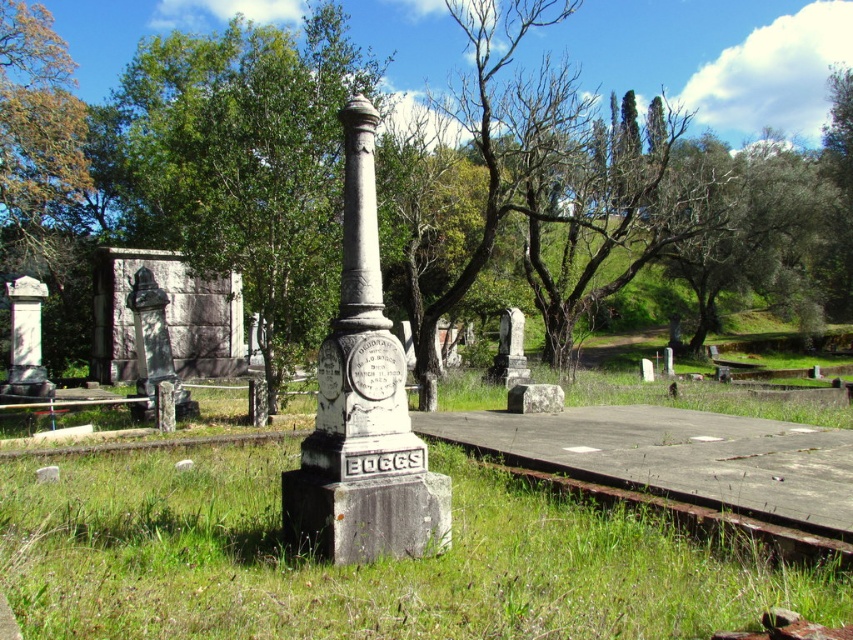
In the scene shown: You are standing at the entrance of the cemetery and want to find the green leafy tree at center. According to the coordinates provided, where should you look relative to your current position?

The green leafy tree at center is located at coordinates point (599, 195), which means it is positioned approximately 30.5 percent from the left edge and 70.3 percent from the top edge of the image. From your current position at the entrance, you should look towards the lower middle area of the cemetery to find it.

You are standing at the point marked by coordinates (366, 564) in the cemetery scene. Based on the image description, what do you see directly beneath your feet?

The point at coordinates (366, 564) indicates green grass at center, so you would see green grass directly beneath your feet.